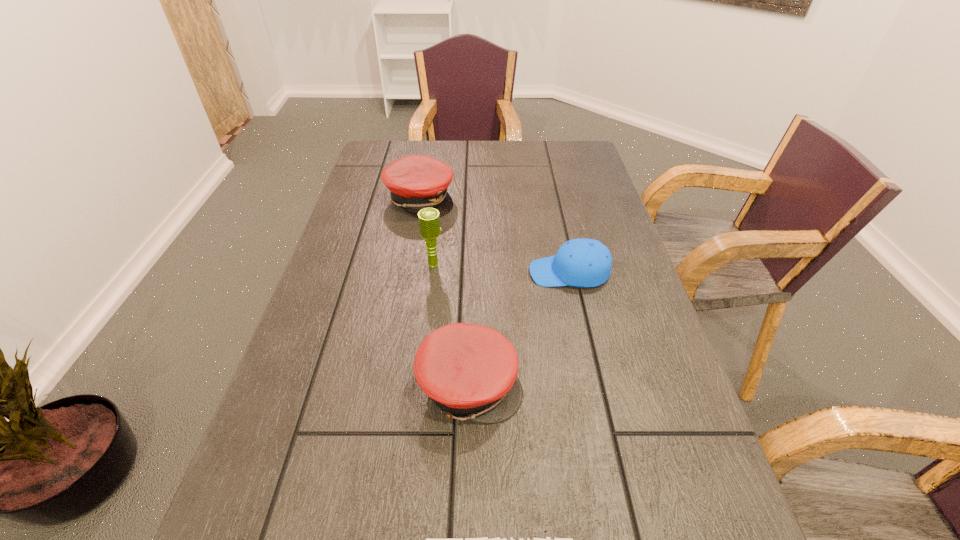
This screenshot has width=960, height=540. I want to click on object that is at the left edge, so click(x=416, y=182).

Where is `object situated at the right edge`? Image resolution: width=960 pixels, height=540 pixels. object situated at the right edge is located at coordinates (581, 262).

In the image, there is a desktop. Where is `vacant space at the far edge`? This screenshot has height=540, width=960. vacant space at the far edge is located at coordinates (483, 168).

In order to click on free space at the left edge in this screenshot , I will do `click(350, 338)`.

Where is `vacant space at the right edge of the desktop`? vacant space at the right edge of the desktop is located at coordinates (667, 491).

Where is `free space at the far left corner of the desktop`? This screenshot has width=960, height=540. free space at the far left corner of the desktop is located at coordinates (410, 154).

Identify the location of free space at the far right corner of the desktop. This screenshot has height=540, width=960. (582, 174).

You are a GUI agent. You are given a task and a screenshot of the screen. Output one action in this format:
    pyautogui.click(x=<x>, y=<y>)
    Task: Click on the free space that is in between the farthest object and the second farthest cap
    The height and width of the screenshot is (540, 960).
    Given the screenshot: What is the action you would take?
    pyautogui.click(x=494, y=236)

Locate an element on the screen. The width and height of the screenshot is (960, 540). free space that is in between the farthest object and the third farthest cap is located at coordinates (444, 292).

Image resolution: width=960 pixels, height=540 pixels. In order to click on free spot between the second farthest cap and the farthest cap in this screenshot , I will do `click(494, 236)`.